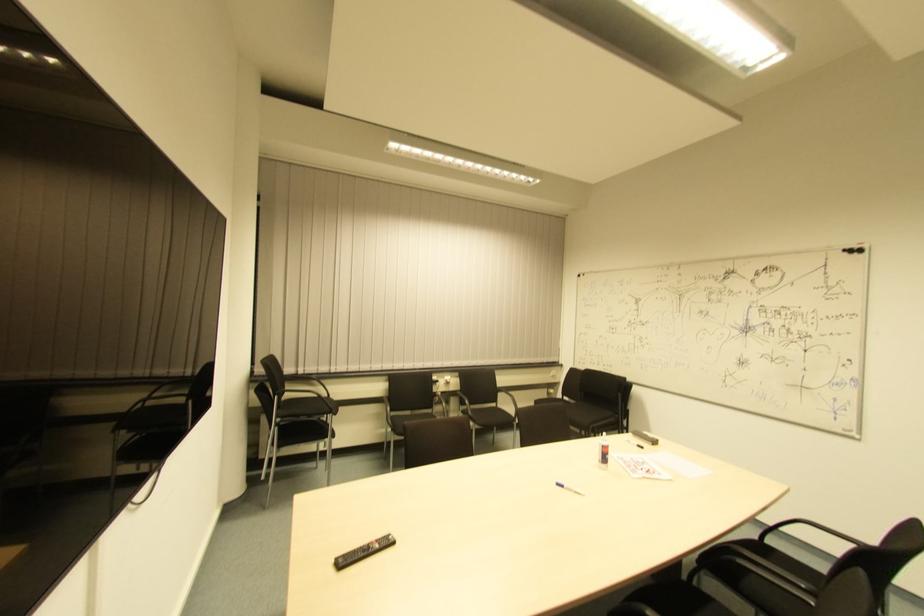
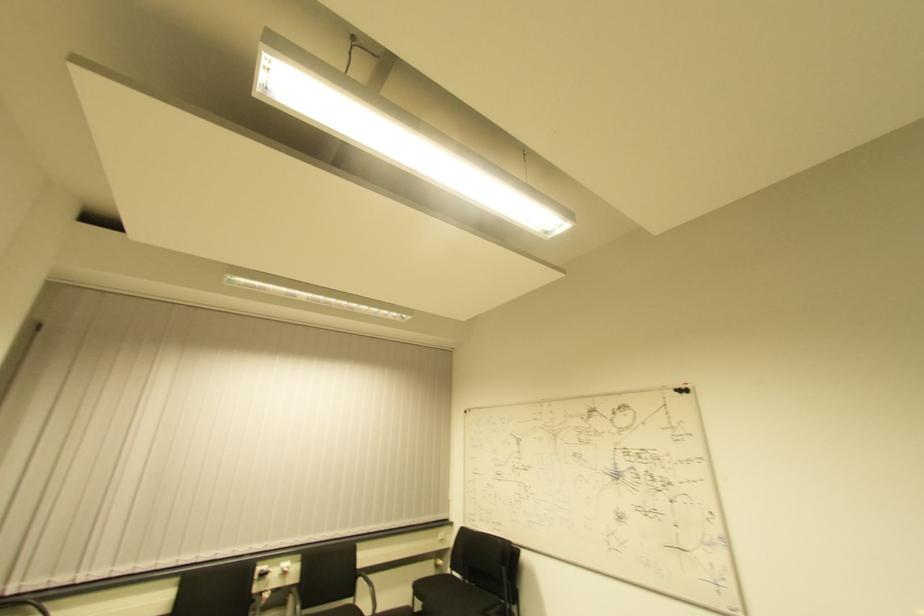
In the second image, find the point that corresponds to (445,386) in the first image.

(283, 576)